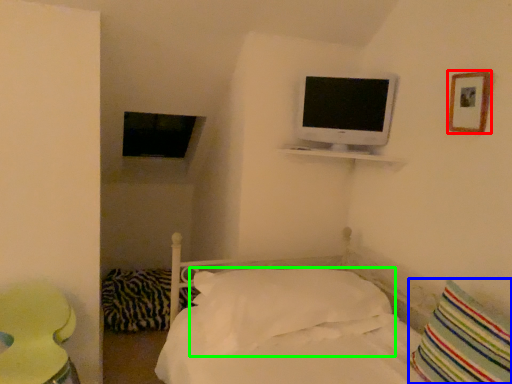
Question: Based on their relative distances, which object is farther from picture frame (highlighted by a red box)? Choose from pillow (highlighted by a blue box) and pillow (highlighted by a green box).

Choices:
 (A) pillow
 (B) pillow

Answer: (B)